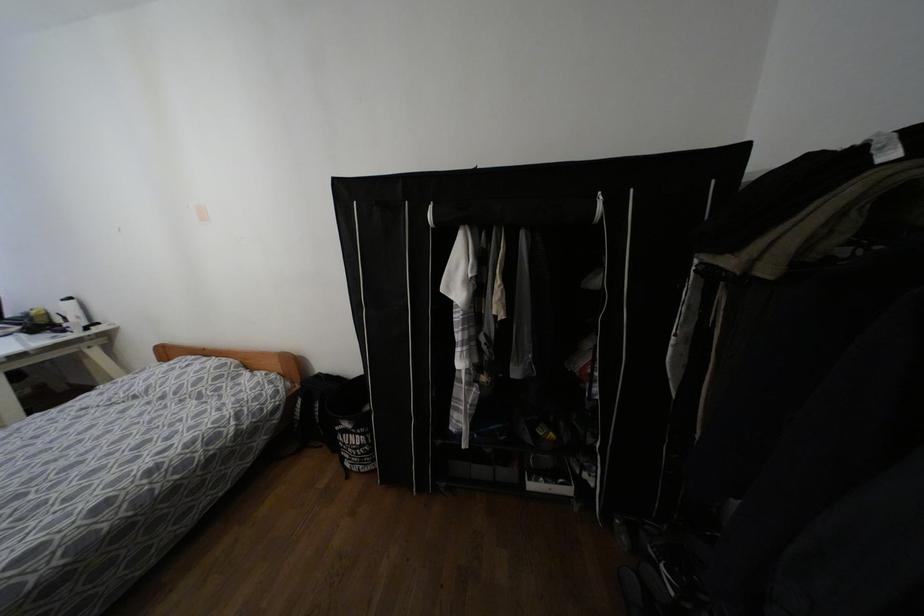
Where is `white wardrobe zipper`? white wardrobe zipper is located at coordinates (599, 207).